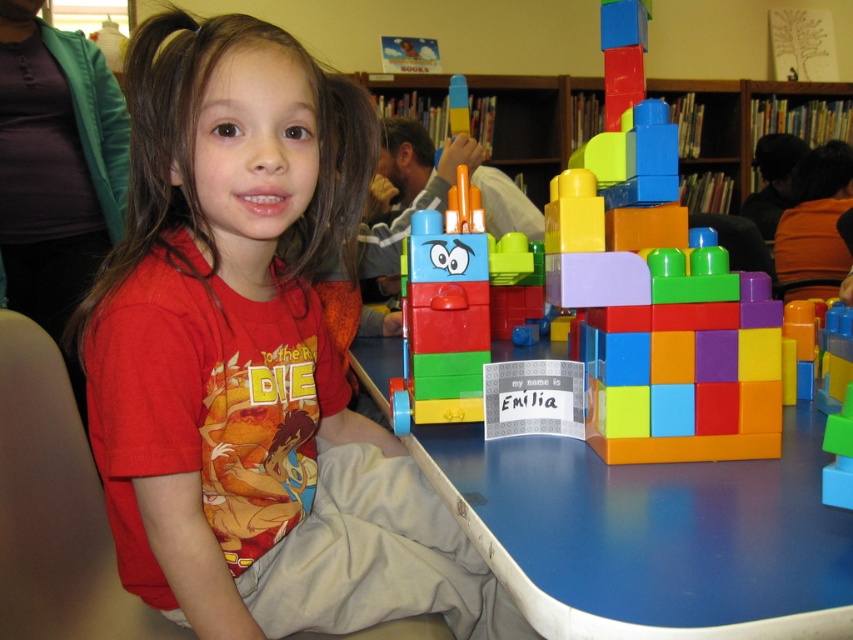
In the scene shown: Does matte red shirt at center have a lesser height compared to blue plastic table at center?

Incorrect, matte red shirt at center's height does not fall short of blue plastic table at center's.

Is matte red shirt at center further to the viewer compared to blue plastic table at center?

That is True.

Locate an element on the screen. matte red shirt at center is located at coordinates (253, 358).

Who is lower down, matte red shirt at center or multicolored plastic blocks at center?

matte red shirt at center is lower down.

Is point (299, 193) positioned behind point (659, 384)?

Yes, it is behind point (659, 384).

Is point (187, 240) closer to camera compared to point (850, 195)?

Yes, point (187, 240) is in front of point (850, 195).

You are a GUI agent. You are given a task and a screenshot of the screen. Output one action in this format:
    pyautogui.click(x=<x>, y=<y>)
    Task: Click on the matte red shirt at center
    This screenshot has width=853, height=640.
    Given the screenshot: What is the action you would take?
    pyautogui.click(x=253, y=358)

Based on the photo, does blue plastic table at center have a larger size compared to multicolored plastic blocks at center?

No.

Identify the location of blue plastic table at center. The image size is (853, 640). (651, 536).

At what (x,y) coordinates should I click in order to perform the action: click on blue plastic table at center. Please return your answer as a coordinate pair (x, y). Looking at the image, I should click on (651, 536).